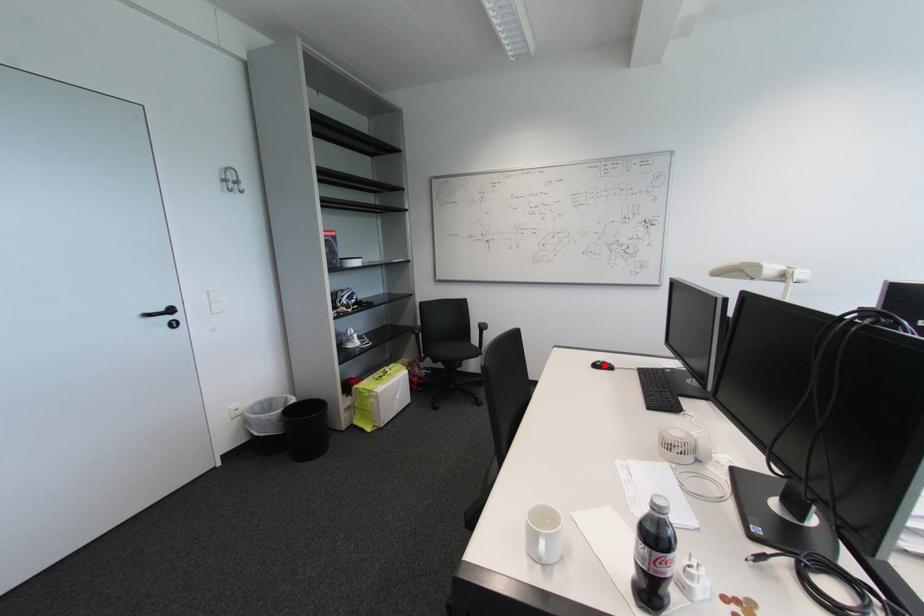
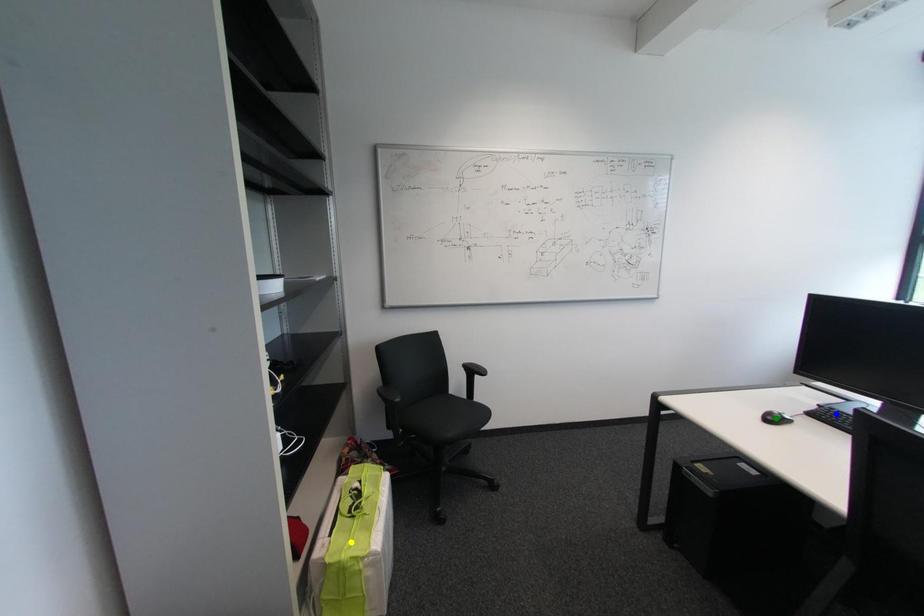
Question: I am providing you with two images of the same scene from different viewpoints. A red point is marked on the first image. You are given multiple points on the second image. Which spot in image 2 lines up with the point in image 1?

Choices:
 (A) green point
 (B) yellow point
 (C) blue point

Answer: (A)